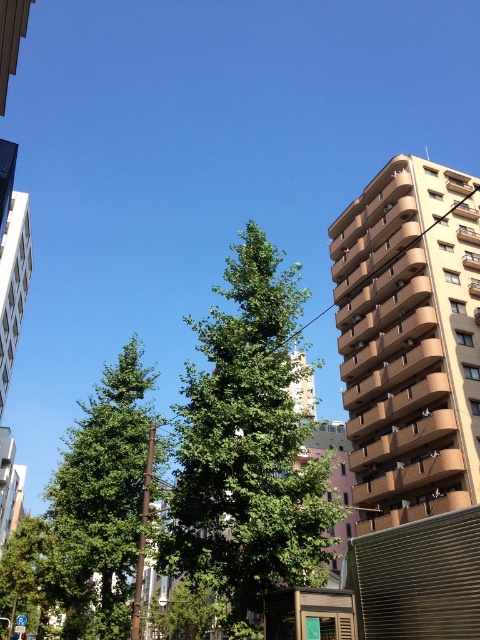
Question: Among these objects, which one is nearest to the camera?

Choices:
 (A) green leafy tree at center
 (B) green leafy tree at left

Answer: (A)

Question: Which point appears farthest from the camera in this image?

Choices:
 (A) (320, 552)
 (B) (141, 371)

Answer: (B)

Question: Is green leafy tree at center to the right of green leafy tree at left from the viewer's perspective?

Choices:
 (A) no
 (B) yes

Answer: (B)

Question: Among these points, which one is farthest from the camera?

Choices:
 (A) (119, 605)
 (B) (187, 422)

Answer: (A)

Question: From the image, what is the correct spatial relationship of green leafy tree at center in relation to green leafy tree at left?

Choices:
 (A) right
 (B) left

Answer: (A)

Question: Does green leafy tree at center come behind green leafy tree at left?

Choices:
 (A) yes
 (B) no

Answer: (B)